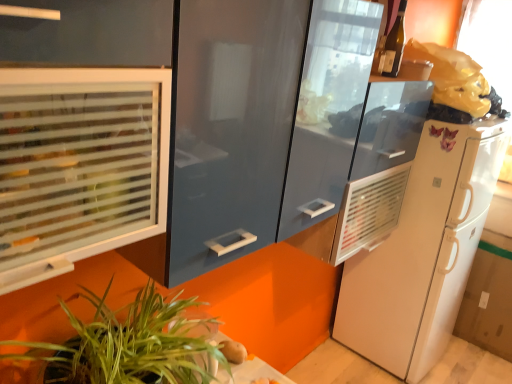
Question: Is smooth brown potato at lower center aimed at green leafy plant at lower left?

Choices:
 (A) no
 (B) yes

Answer: (A)

Question: Is smooth brown potato at lower center taller than green leafy plant at lower left?

Choices:
 (A) yes
 (B) no

Answer: (B)

Question: From a real-world perspective, is smooth brown potato at lower center positioned over green leafy plant at lower left based on gravity?

Choices:
 (A) yes
 (B) no

Answer: (B)

Question: Does smooth brown potato at lower center lie in front of green leafy plant at lower left?

Choices:
 (A) yes
 (B) no

Answer: (B)

Question: Does smooth brown potato at lower center have a lesser height compared to green leafy plant at lower left?

Choices:
 (A) yes
 (B) no

Answer: (A)

Question: Would you say smooth brown potato at lower center is a long distance from green leafy plant at lower left?

Choices:
 (A) no
 (B) yes

Answer: (A)

Question: Can you see smooth brown potato at lower center touching translucent glass wine bottle at upper right?

Choices:
 (A) yes
 (B) no

Answer: (B)

Question: Is smooth brown potato at lower center oriented towards translucent glass wine bottle at upper right?

Choices:
 (A) yes
 (B) no

Answer: (B)

Question: From a real-world perspective, is smooth brown potato at lower center on top of translucent glass wine bottle at upper right?

Choices:
 (A) yes
 (B) no

Answer: (B)

Question: Is translucent glass wine bottle at upper right located within smooth brown potato at lower center?

Choices:
 (A) yes
 (B) no

Answer: (B)

Question: From a real-world perspective, is smooth brown potato at lower center below translucent glass wine bottle at upper right?

Choices:
 (A) yes
 (B) no

Answer: (A)

Question: Considering the relative sizes of smooth brown potato at lower center and translucent glass wine bottle at upper right in the image provided, is smooth brown potato at lower center smaller than translucent glass wine bottle at upper right?

Choices:
 (A) no
 (B) yes

Answer: (B)

Question: Is translucent glass wine bottle at upper right turned away from smooth brown potato at lower center?

Choices:
 (A) no
 (B) yes

Answer: (A)